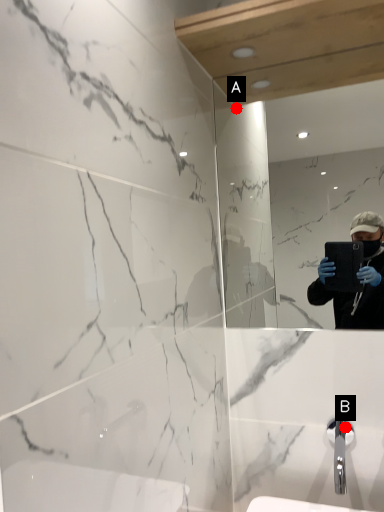
Question: Two points are circled on the image, labeled by A and B beside each circle. Which point is farther to the camera?

Choices:
 (A) A is further
 (B) B is further

Answer: (A)